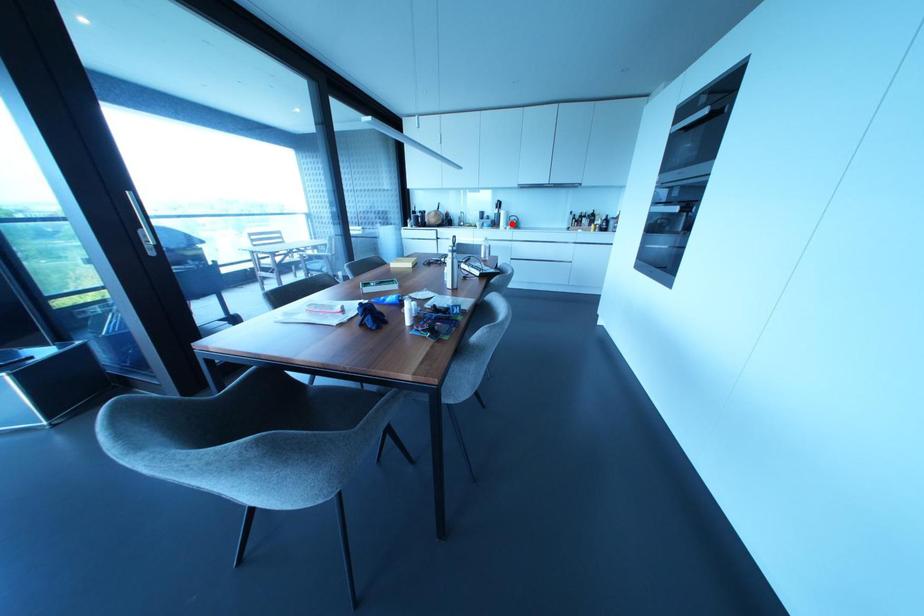
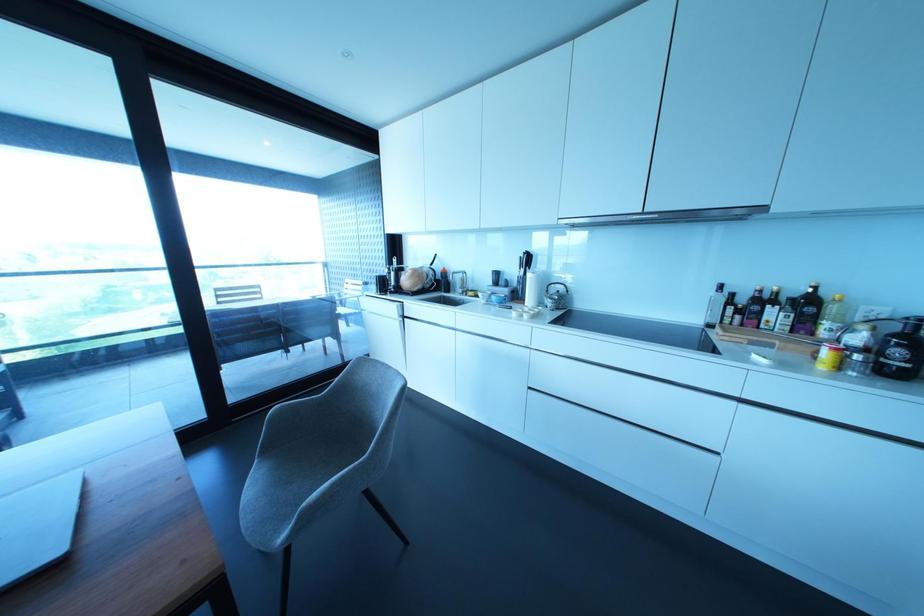
Question: I am providing you with two images of the same scene from different viewpoints. In image1, a red point is highlighted. Considering the same 3D point in image2, which of the following is correct?

Choices:
 (A) It is closer
 (B) It is farther

Answer: (B)